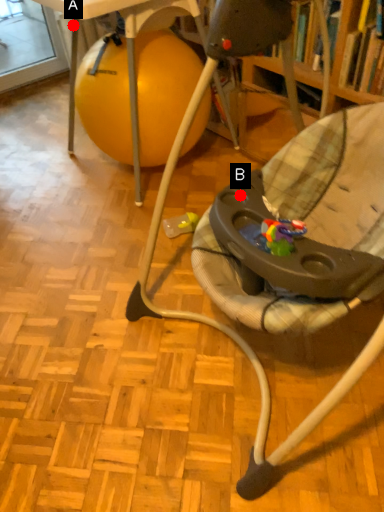
Question: Two points are circled on the image, labeled by A and B beside each circle. Which point appears farthest from the camera in this image?

Choices:
 (A) A is further
 (B) B is further

Answer: (A)